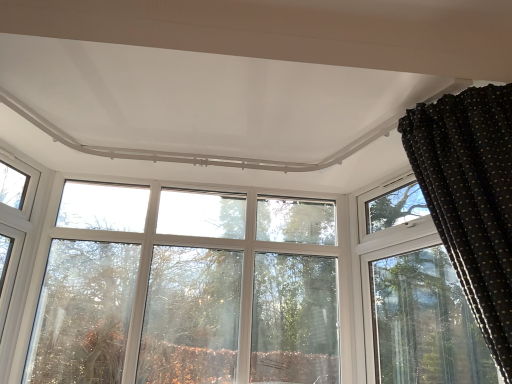
Question: From the image's perspective, would you say clear glass window at upper left is shown under transparent glass tree at center?

Choices:
 (A) yes
 (B) no

Answer: (B)

Question: Is clear glass window at upper left next to transparent glass tree at center and touching it?

Choices:
 (A) yes
 (B) no

Answer: (B)

Question: Can you confirm if clear glass window at upper left is positioned to the right of transparent glass tree at center?

Choices:
 (A) no
 (B) yes

Answer: (A)

Question: Is clear glass window at upper left aimed at transparent glass tree at center?

Choices:
 (A) yes
 (B) no

Answer: (B)

Question: Considering the relative sizes of clear glass window at upper left and transparent glass tree at center in the image provided, is clear glass window at upper left taller than transparent glass tree at center?

Choices:
 (A) no
 (B) yes

Answer: (A)

Question: Can we say clear glass window at upper left lies outside transparent glass tree at center?

Choices:
 (A) no
 (B) yes

Answer: (B)

Question: Can you see transparent glass tree at center touching black dotted fabric at upper right?

Choices:
 (A) no
 (B) yes

Answer: (A)

Question: From the image's perspective, is transparent glass tree at center located beneath black dotted fabric at upper right?

Choices:
 (A) no
 (B) yes

Answer: (B)

Question: Are transparent glass tree at center and black dotted fabric at upper right far apart?

Choices:
 (A) yes
 (B) no

Answer: (A)

Question: Can you confirm if transparent glass tree at center is positioned to the right of black dotted fabric at upper right?

Choices:
 (A) no
 (B) yes

Answer: (A)

Question: Is transparent glass tree at center positioned beyond the bounds of black dotted fabric at upper right?

Choices:
 (A) yes
 (B) no

Answer: (A)

Question: Can you confirm if transparent glass tree at center is bigger than black dotted fabric at upper right?

Choices:
 (A) no
 (B) yes

Answer: (A)

Question: Are black dotted fabric at upper right and transparent glass tree at center making contact?

Choices:
 (A) yes
 (B) no

Answer: (B)